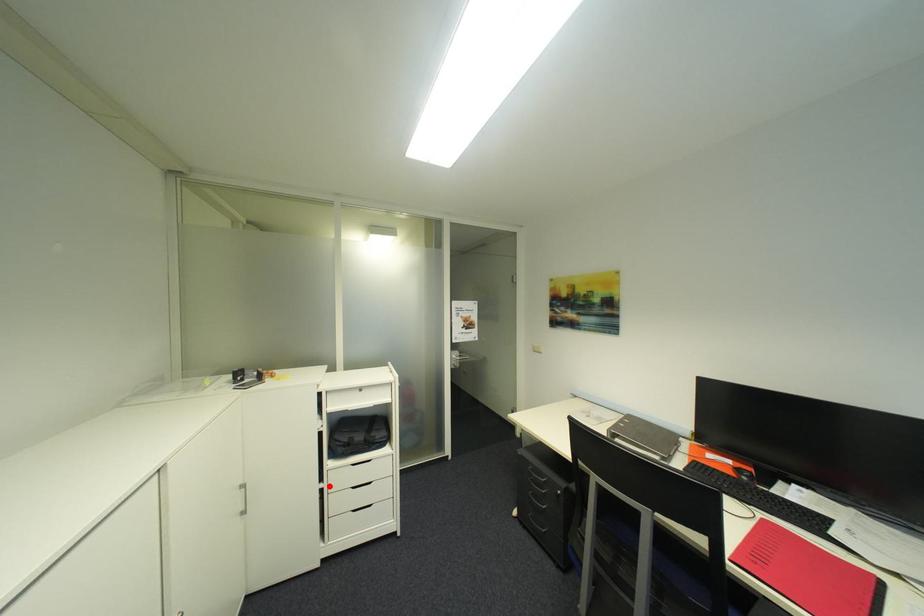
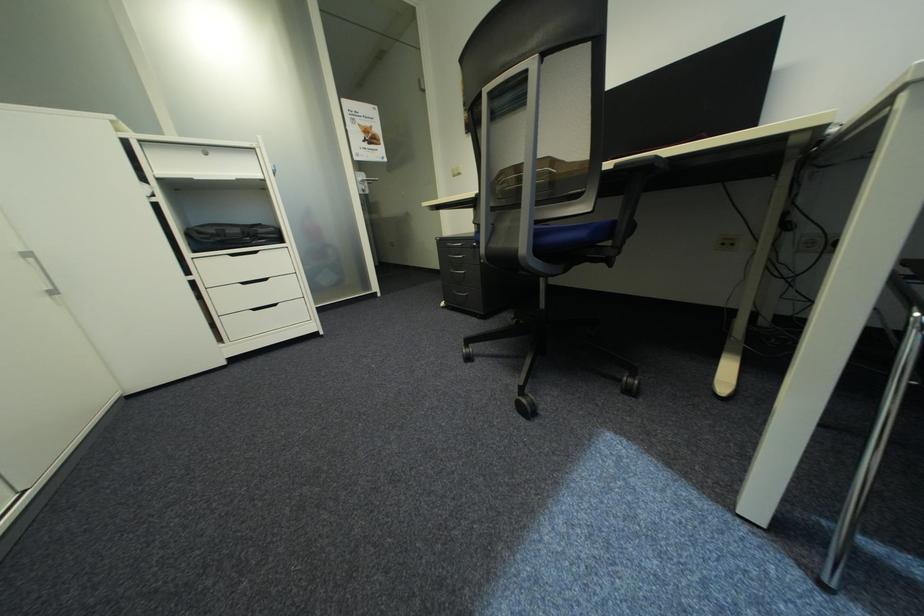
Find the pixel in the second image that matches the highlighted location in the first image.

(199, 278)